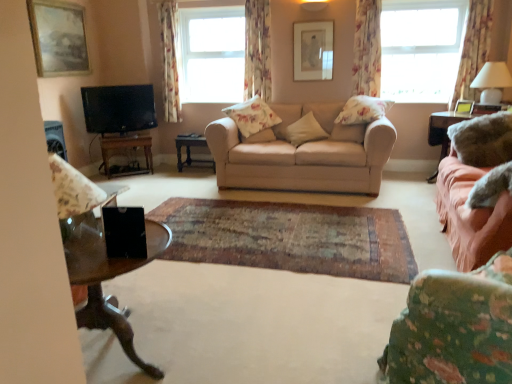
Question: Does floral fabric pillow at center, placed as the first pillow when sorted from left to right, appear on the left side of satin pink fabric at right, acting as the third table starting from the left?

Choices:
 (A) yes
 (B) no

Answer: (A)

Question: Can we say floral fabric pillow at center, the fourth pillow from the right, lies outside satin pink fabric at right, marked as the first table in a right-to-left arrangement?

Choices:
 (A) no
 (B) yes

Answer: (B)

Question: Is satin pink fabric at right, marked as the first table in a right-to-left arrangement, located within floral fabric pillow at center, the fourth pillow from the right?

Choices:
 (A) no
 (B) yes

Answer: (A)

Question: From a real-world perspective, is floral fabric pillow at center, the fourth pillow from the right, physically below satin pink fabric at right, marked as the first table in a right-to-left arrangement?

Choices:
 (A) no
 (B) yes

Answer: (A)

Question: Is floral fabric pillow at center, the fourth pillow from the right, looking in the opposite direction of satin pink fabric at right, marked as the first table in a right-to-left arrangement?

Choices:
 (A) no
 (B) yes

Answer: (A)

Question: Considering the positions of floral fabric curtain at upper center, the third curtain viewed from the right, and beige fabric couch at center, which ranks as the 1th studio couch in left-to-right order, in the image, is floral fabric curtain at upper center, the third curtain viewed from the right, taller or shorter than beige fabric couch at center, which ranks as the 1th studio couch in left-to-right order,?

Choices:
 (A) tall
 (B) short

Answer: (A)

Question: From the image's perspective, relative to beige fabric couch at center, which ranks as the 1th studio couch in left-to-right order, is floral fabric curtain at upper center, the third curtain viewed from the right, above or below?

Choices:
 (A) below
 (B) above

Answer: (B)

Question: Based on their sizes in the image, would you say floral fabric curtain at upper center, placed as the 2th curtain when sorted from left to right, is bigger or smaller than beige fabric couch at center, which ranks as the 2th studio couch in right-to-left order?

Choices:
 (A) big
 (B) small

Answer: (B)

Question: Is point (250, 3) closer or farther from the camera than point (338, 105)?

Choices:
 (A) closer
 (B) farther

Answer: (B)

Question: Based on their sizes in the image, would you say fluffy white pillow at center, which appears as the 1th pillow when viewed from the right, is bigger or smaller than floral fabric curtain at upper center, the third curtain viewed from the right?

Choices:
 (A) small
 (B) big

Answer: (A)

Question: Relative to floral fabric curtain at upper center, the third curtain viewed from the right, is fluffy white pillow at center, which appears as the 1th pillow when viewed from the right, in front or behind?

Choices:
 (A) front
 (B) behind

Answer: (A)

Question: Considering the positions of fluffy white pillow at center, which ranks as the 4th pillow in left-to-right order, and floral fabric curtain at upper center, placed as the 2th curtain when sorted from left to right, in the image, is fluffy white pillow at center, which ranks as the 4th pillow in left-to-right order, taller or shorter than floral fabric curtain at upper center, placed as the 2th curtain when sorted from left to right,?

Choices:
 (A) tall
 (B) short

Answer: (B)

Question: From the image's perspective, is fluffy white pillow at center, which appears as the 1th pillow when viewed from the right, positioned above or below floral fabric curtain at upper center, placed as the 2th curtain when sorted from left to right?

Choices:
 (A) above
 (B) below

Answer: (B)

Question: Visually, is floral fabric curtain at right, the third curtain when ordered from left to right, positioned to the left or to the right of matte floral fabric armchair at left?

Choices:
 (A) right
 (B) left

Answer: (A)

Question: From the image's perspective, is floral fabric curtain at right, marked as the second curtain in a right-to-left arrangement, positioned above or below matte floral fabric armchair at left?

Choices:
 (A) below
 (B) above

Answer: (B)